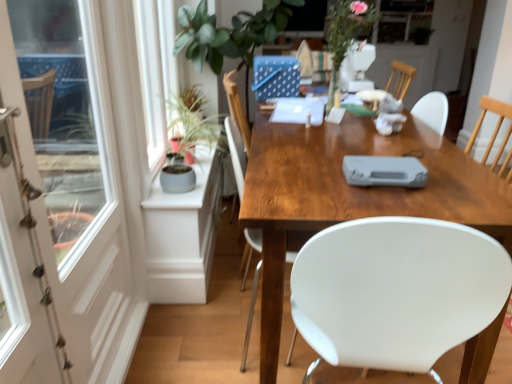
Where is `vacant space underneath floral arrangement at upper center (from a real-world perspective)`? This screenshot has width=512, height=384. vacant space underneath floral arrangement at upper center (from a real-world perspective) is located at coordinates (344, 112).